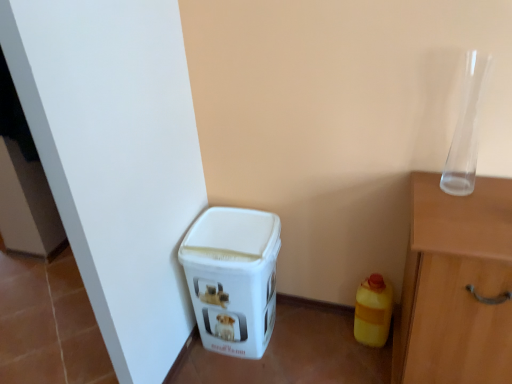
Question: Considering the relative positions of transparent glass vase at upper right and yellow matte plastic bottle at lower right in the image provided, is transparent glass vase at upper right to the left or to the right of yellow matte plastic bottle at lower right?

Choices:
 (A) left
 (B) right

Answer: (B)

Question: Relative to yellow matte plastic bottle at lower right, is transparent glass vase at upper right in front or behind?

Choices:
 (A) front
 (B) behind

Answer: (A)

Question: Estimate the real-world distances between objects in this image. Which object is farther from the transparent glass vase at upper right?

Choices:
 (A) yellow matte plastic bottle at lower right
 (B) white plastic bin at lower left

Answer: (B)

Question: Considering the real-world distances, which object is farthest from the white plastic bin at lower left?

Choices:
 (A) yellow matte plastic bottle at lower right
 (B) transparent glass vase at upper right

Answer: (B)